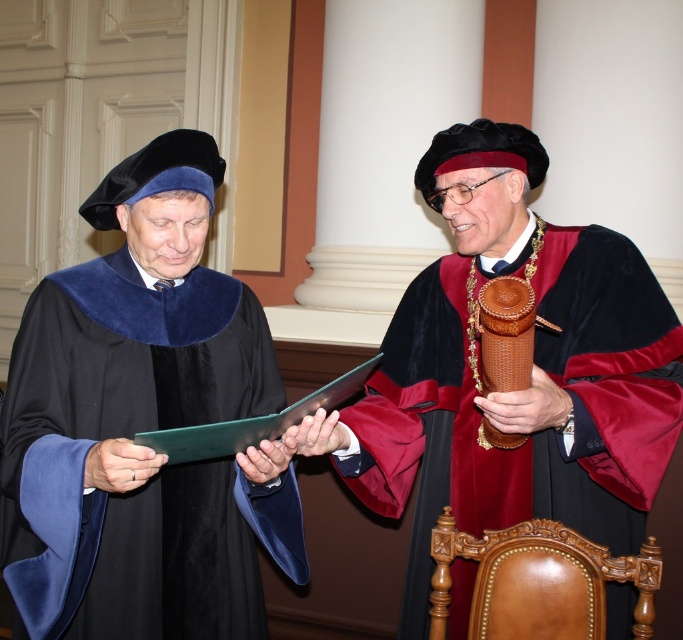
I want to click on velvet black robe at left, so click(130, 435).

Does velvet black robe at left appear over velvet maroon and black gown at center?

Incorrect, velvet black robe at left is not positioned above velvet maroon and black gown at center.

At what (x,y) coordinates should I click in order to perform the action: click on velvet black robe at left. Please return your answer as a coordinate pair (x, y). Image resolution: width=683 pixels, height=640 pixels. Looking at the image, I should click on (130, 435).